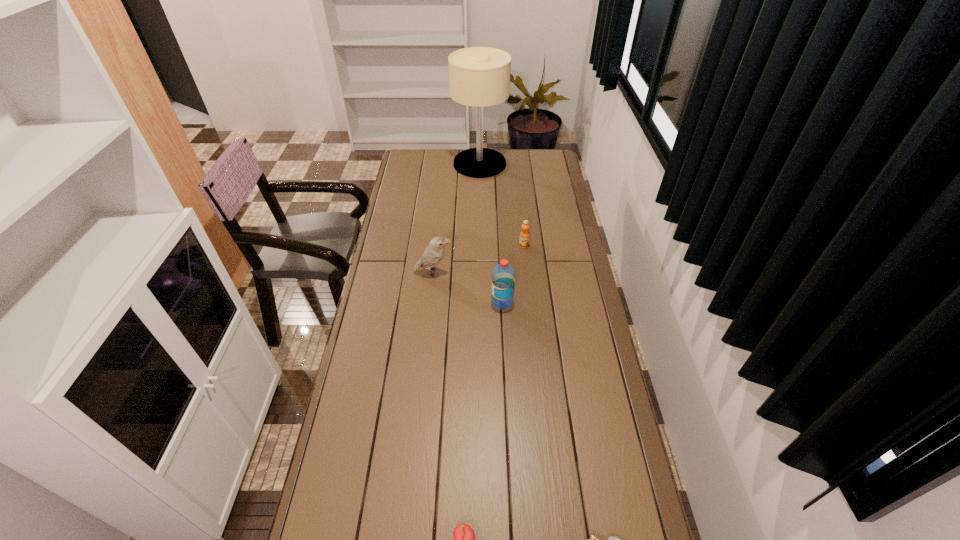
Image resolution: width=960 pixels, height=540 pixels. I want to click on table lamp, so click(478, 76).

The width and height of the screenshot is (960, 540). What are the coordinates of `the tallest object` in the screenshot? It's located at (478, 76).

Identify the location of the fourth farthest object. (503, 275).

This screenshot has width=960, height=540. I want to click on bird, so click(x=432, y=255).

Identify the location of orange juice. The width and height of the screenshot is (960, 540). (524, 235).

Where is `the fourth tallest object`? The height and width of the screenshot is (540, 960). the fourth tallest object is located at coordinates (524, 235).

I want to click on vacant space positioned on the right of the table lamp, so click(543, 164).

You are a GUI agent. You are given a task and a screenshot of the screen. Output one action in this format:
    pyautogui.click(x=<x>, y=<y>)
    Task: Click on the free space located on the front label of the water bottle
    
    Given the screenshot: What is the action you would take?
    pyautogui.click(x=402, y=302)

What are the coordinates of `vacant position located 0.150m on the front label of the water bottle` in the screenshot? It's located at (452, 302).

Image resolution: width=960 pixels, height=540 pixels. Find the location of `blank area located 0.270m on the front label of the water bottle`. blank area located 0.270m on the front label of the water bottle is located at coordinates (420, 302).